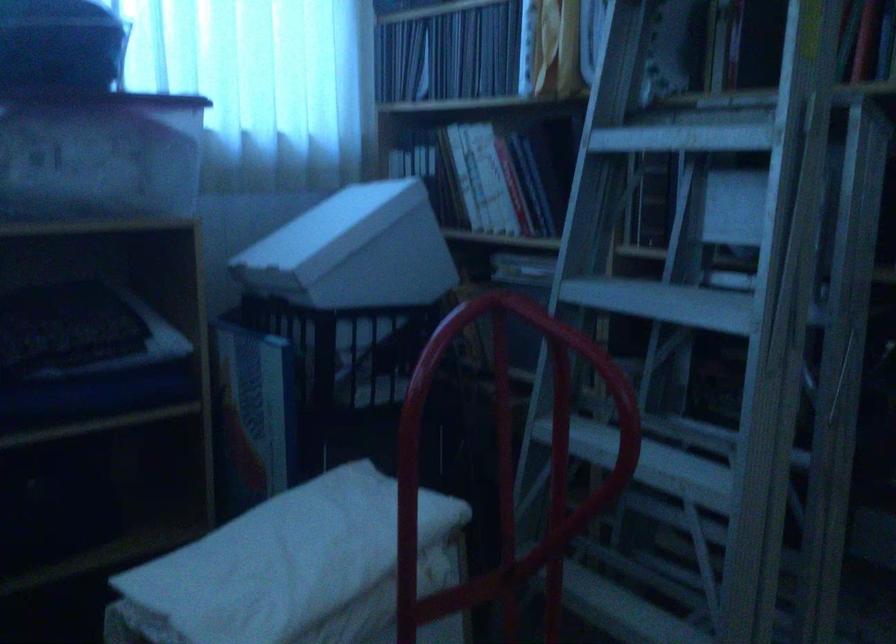
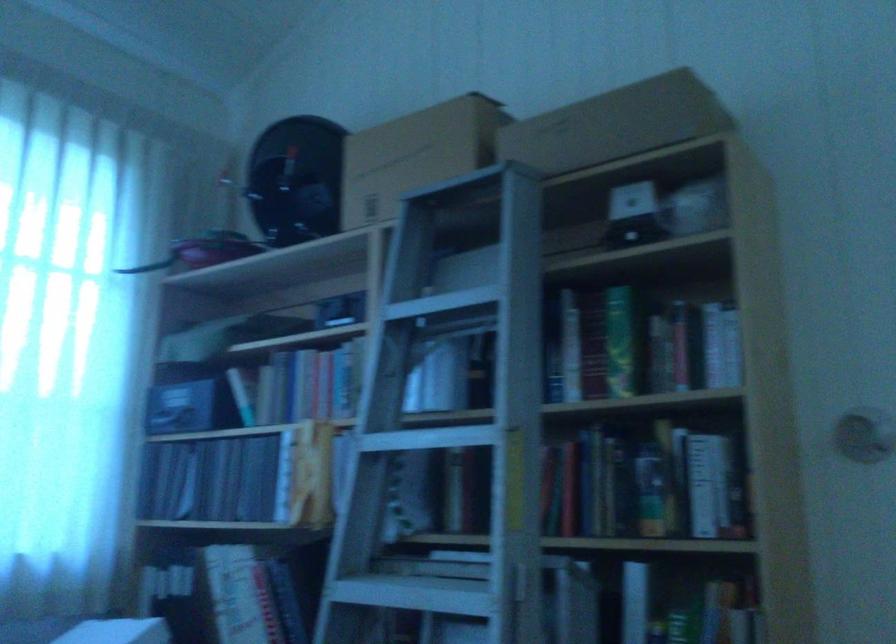
In the scene shown: What movement of the cameraman would produce the second image?

The cameraman moved toward right, backward.